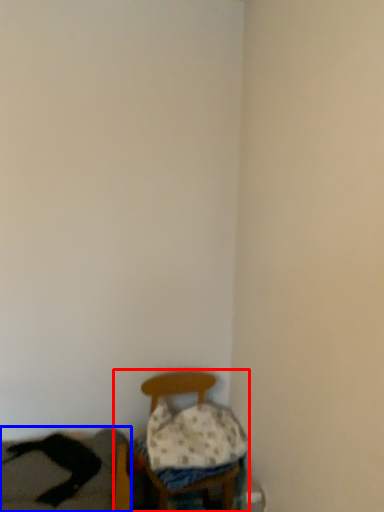
Question: Which of the following is the farthest to the observer, furniture (highlighted by a red box) or couch (highlighted by a blue box)?

Choices:
 (A) furniture
 (B) couch

Answer: (A)